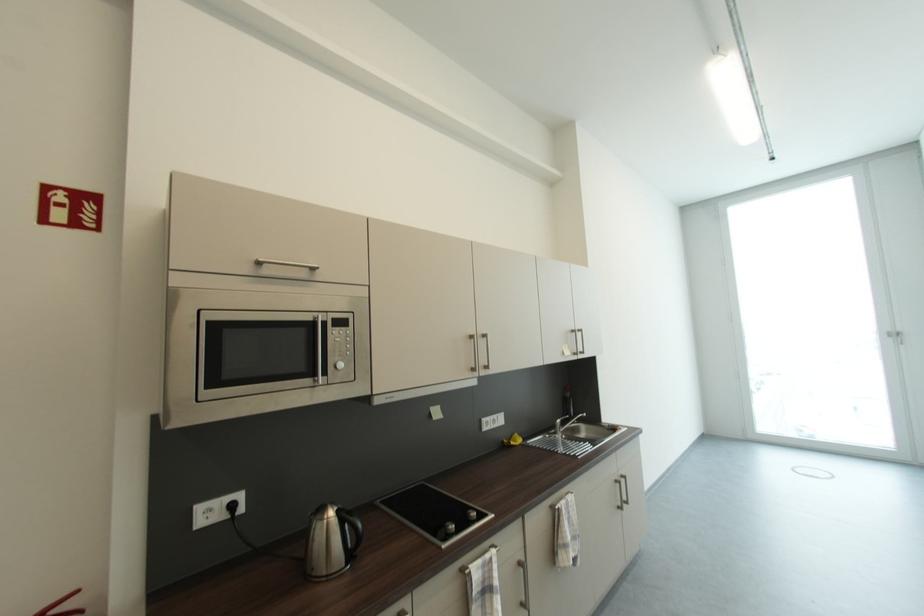
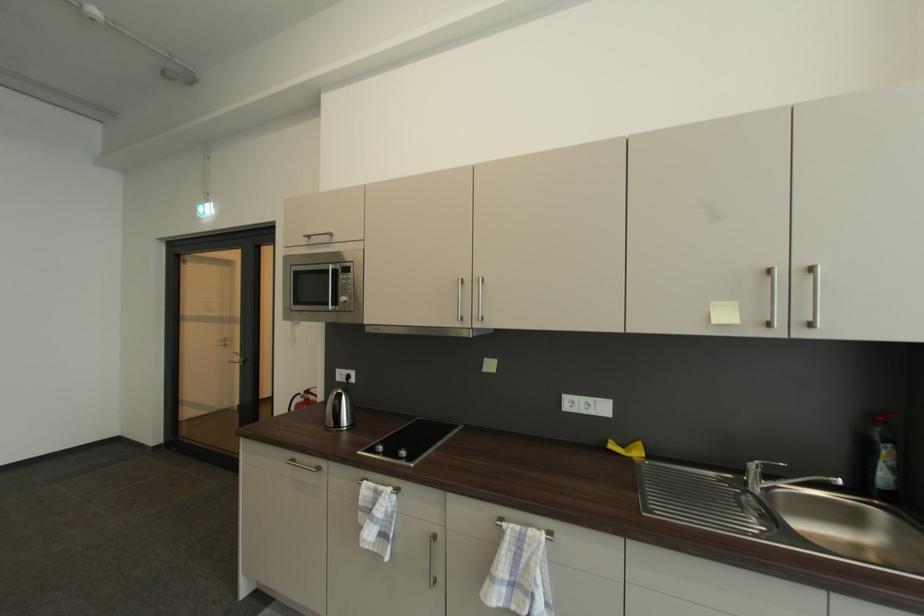
Locate, in the second image, the point that corresponds to point (511, 444) in the first image.

(613, 443)